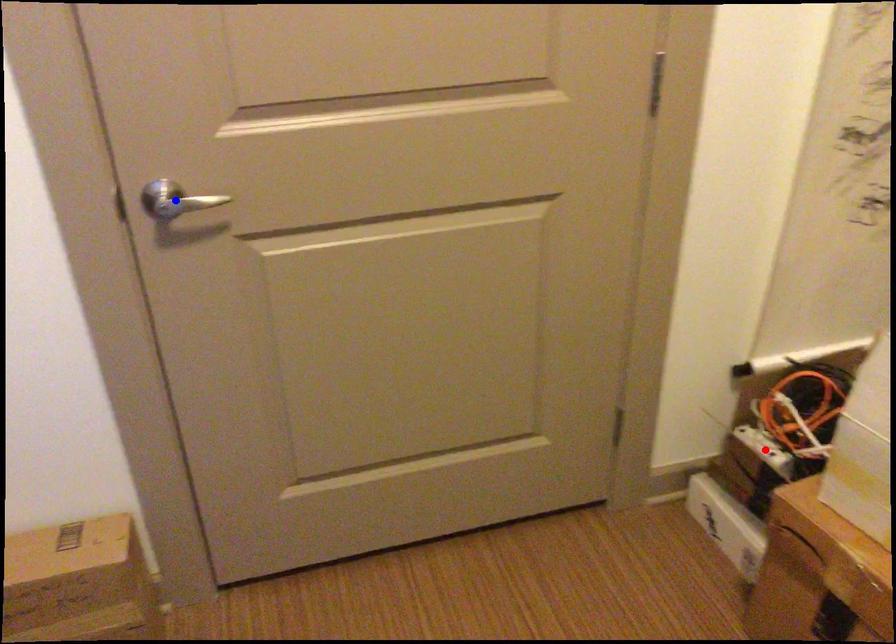
Question: Two points are marked on the image. Which point is closer to the camera?

Choices:
 (A) Blue point is closer.
 (B) Red point is closer.

Answer: (A)